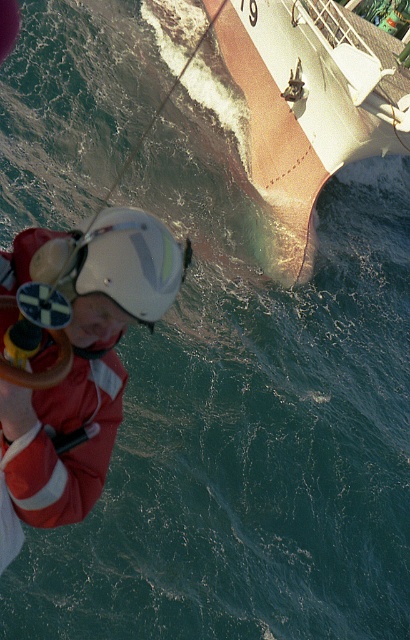
Which is in front, point (111, 353) or point (109, 212)?

Point (109, 212) is more forward.

Is red reflective jacket at left to the left of white matte helmet at center from the viewer's perspective?

Yes, red reflective jacket at left is to the left of white matte helmet at center.

Who is more distant from viewer, (143, 317) or (120, 212)?

The point (120, 212) is behind.

At what (x,y) coordinates should I click in order to perform the action: click on red reflective jacket at left. Please return your answer as a coordinate pair (x, y). Looking at the image, I should click on (79, 364).

Is smooth pinkish boat at upper center smaller than white matte helmet at center?

Actually, smooth pinkish boat at upper center might be larger than white matte helmet at center.

Does smooth pinkish boat at upper center appear over white matte helmet at center?

Yes, smooth pinkish boat at upper center is above white matte helmet at center.

This screenshot has height=640, width=410. I want to click on smooth pinkish boat at upper center, so click(311, 104).

Who is shorter, red reflective jacket at left or smooth pinkish boat at upper center?

Standing shorter between the two is red reflective jacket at left.

Is the position of red reflective jacket at left more distant than that of smooth pinkish boat at upper center?

No, it is in front of smooth pinkish boat at upper center.

What do you see at coordinates (79, 364) in the screenshot? The height and width of the screenshot is (640, 410). I see `red reflective jacket at left` at bounding box center [79, 364].

Where is `red reflective jacket at left`? The image size is (410, 640). red reflective jacket at left is located at coordinates (79, 364).